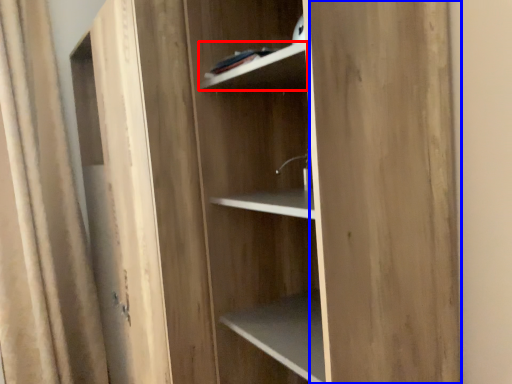
Question: Which object is further to the camera taking this photo, cabinet (highlighted by a red box) or plywood (highlighted by a blue box)?

Choices:
 (A) cabinet
 (B) plywood

Answer: (A)